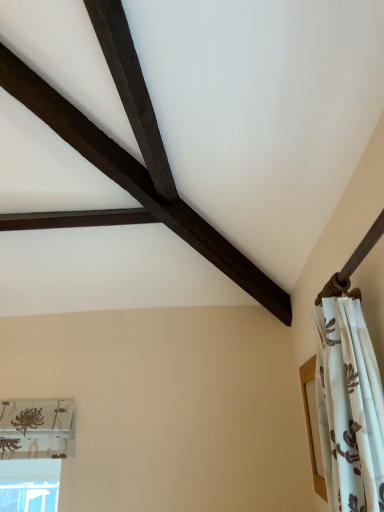
What do you see at coordinates (29, 485) in the screenshot? The image size is (384, 512). I see `transparent glass window at lower left` at bounding box center [29, 485].

Identify the location of transparent glass window at lower left. Image resolution: width=384 pixels, height=512 pixels. (29, 485).

What do you see at coordinates (349, 407) in the screenshot? This screenshot has width=384, height=512. I see `white floral fabric curtain at right` at bounding box center [349, 407].

At what (x,y) coordinates should I click in order to perform the action: click on white floral fabric curtain at right. Please return your answer as a coordinate pair (x, y). The height and width of the screenshot is (512, 384). Looking at the image, I should click on (349, 407).

Looking at this image, in order to face white floral fabric curtain at right, should I rotate leftwards or rightwards?

You should rotate right by 17.468 degrees.

You are a GUI agent. You are given a task and a screenshot of the screen. Output one action in this format:
    pyautogui.click(x=<x>, y=<y>)
    Task: Click on the transparent glass window at lower left
    The height and width of the screenshot is (512, 384).
    Given the screenshot: What is the action you would take?
    pyautogui.click(x=29, y=485)

Between white floral fabric curtain at right and transparent glass window at lower left, which one appears on the left side from the viewer's perspective?

transparent glass window at lower left is more to the left.

Which object is further away from the camera taking this photo, white floral fabric curtain at right or transparent glass window at lower left?

transparent glass window at lower left is further from the camera.

Considering the positions of point (382, 504) and point (5, 479), is point (382, 504) closer or farther from the camera than point (5, 479)?

Point (382, 504) appears to be closer to the viewer than point (5, 479).

From the image's perspective, which is below, white floral fabric curtain at right or transparent glass window at lower left?

From the image's view, transparent glass window at lower left is below.

From a real-world perspective, between white floral fabric curtain at right and transparent glass window at lower left, who is vertically higher?

From a 3D spatial view, white floral fabric curtain at right is above.

Looking at their sizes, would you say white floral fabric curtain at right is wider or thinner than transparent glass window at lower left?

white floral fabric curtain at right is thinner than transparent glass window at lower left.

Who is taller, white floral fabric curtain at right or transparent glass window at lower left?

white floral fabric curtain at right is taller.

Does white floral fabric curtain at right have a larger size compared to transparent glass window at lower left?

Yes, white floral fabric curtain at right is bigger than transparent glass window at lower left.

Can transparent glass window at lower left be found inside white floral fabric curtain at right?

That's incorrect, transparent glass window at lower left is not inside white floral fabric curtain at right.

Does white floral fabric curtain at right touch transparent glass window at lower left?

No, white floral fabric curtain at right is not with transparent glass window at lower left.

Is transparent glass window at lower left at the back of white floral fabric curtain at right?

white floral fabric curtain at right is not turned away from transparent glass window at lower left.

How different are the orientations of white floral fabric curtain at right and transparent glass window at lower left in degrees?

92.5 degrees.

Image resolution: width=384 pixels, height=512 pixels. What are the coordinates of `window located below the white floral fabric curtain at right (from the image's perspective)` in the screenshot? It's located at (29, 485).

Which is more to the right, transparent glass window at lower left or white floral fabric curtain at right?

white floral fabric curtain at right is more to the right.

Is transparent glass window at lower left in front of or behind white floral fabric curtain at right in the image?

Visually, transparent glass window at lower left is located behind white floral fabric curtain at right.

Considering the points (17, 507) and (324, 326), which point is behind, point (17, 507) or point (324, 326)?

Point (17, 507)

From the image's perspective, is transparent glass window at lower left on top of white floral fabric curtain at right?

No.

From a real-world perspective, who is located higher, transparent glass window at lower left or white floral fabric curtain at right?

white floral fabric curtain at right is physically above.

In terms of width, does transparent glass window at lower left look wider or thinner when compared to white floral fabric curtain at right?

Clearly, transparent glass window at lower left has more width compared to white floral fabric curtain at right.

Who is taller, transparent glass window at lower left or white floral fabric curtain at right?

white floral fabric curtain at right is taller.

From the picture: Which of these two, transparent glass window at lower left or white floral fabric curtain at right, is smaller?

Smaller between the two is transparent glass window at lower left.

Is white floral fabric curtain at right inside transparent glass window at lower left?

Actually, white floral fabric curtain at right is outside transparent glass window at lower left.

In the scene shown: Is transparent glass window at lower left not near white floral fabric curtain at right?

Absolutely, transparent glass window at lower left is distant from white floral fabric curtain at right.

Is transparent glass window at lower left aimed at white floral fabric curtain at right?

No, transparent glass window at lower left does not turn towards white floral fabric curtain at right.

How much distance is there between transparent glass window at lower left and white floral fabric curtain at right?

2.28 meters.

Find the location of a particular element. The image size is (384, 512). curtain above the transparent glass window at lower left (from the image's perspective) is located at coordinates (349, 407).

Locate an element on the screen. The image size is (384, 512). window that appears on the left of white floral fabric curtain at right is located at coordinates (29, 485).

At what (x,y) coordinates should I click in order to perform the action: click on window below the white floral fabric curtain at right (from a real-world perspective). Please return your answer as a coordinate pair (x, y). This screenshot has height=512, width=384. Looking at the image, I should click on (29, 485).